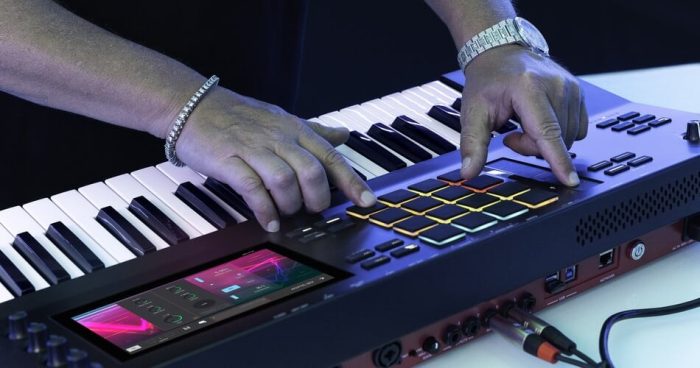
This screenshot has width=700, height=368. I want to click on input jacks, so click(x=388, y=351), click(x=456, y=335), click(x=474, y=330), click(x=493, y=318), click(x=507, y=311), click(x=524, y=304).